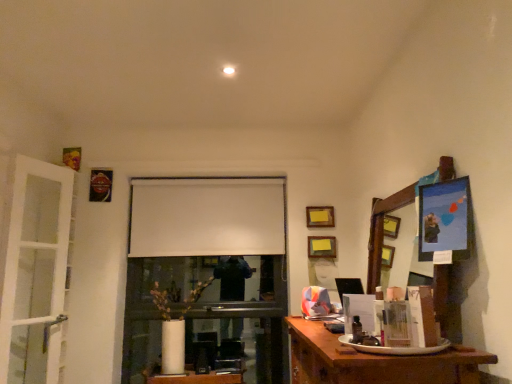
Question: Can you confirm if wooden desk at lower right is smaller than white glass door at left?

Choices:
 (A) no
 (B) yes

Answer: (A)

Question: Could you tell me if wooden desk at lower right is facing white glass door at left?

Choices:
 (A) yes
 (B) no

Answer: (B)

Question: From a real-world perspective, is wooden desk at lower right on white glass door at left?

Choices:
 (A) yes
 (B) no

Answer: (B)

Question: Is the position of wooden desk at lower right more distant than that of white glass door at left?

Choices:
 (A) no
 (B) yes

Answer: (A)

Question: Is wooden desk at lower right to the left of white glass door at left from the viewer's perspective?

Choices:
 (A) yes
 (B) no

Answer: (B)

Question: From a real-world perspective, is wooden desk at lower right physically located above or below yellow matte picture frame at upper center, positioned as the 1th picture frame in bottom-to-top order?

Choices:
 (A) above
 (B) below

Answer: (B)

Question: Would you say wooden desk at lower right is inside or outside yellow matte picture frame at upper center, positioned as the 1th picture frame in bottom-to-top order?

Choices:
 (A) inside
 (B) outside

Answer: (B)

Question: Considering their positions, is wooden desk at lower right located in front of or behind yellow matte picture frame at upper center, which appears as the second picture frame when viewed from the top?

Choices:
 (A) behind
 (B) front

Answer: (B)

Question: Is wooden desk at lower right taller or shorter than yellow matte picture frame at upper center, which appears as the second picture frame when viewed from the top?

Choices:
 (A) tall
 (B) short

Answer: (A)

Question: Is point (240, 182) closer or farther from the camera than point (325, 221)?

Choices:
 (A) closer
 (B) farther

Answer: (B)

Question: Based on their positions, is white matte projection screen at center located to the left or right of wooden picture frame at upper center, marked as the first picture frame in a top-to-bottom arrangement?

Choices:
 (A) right
 (B) left

Answer: (B)

Question: Which is correct: white matte projection screen at center is inside wooden picture frame at upper center, marked as the first picture frame in a top-to-bottom arrangement, or outside of it?

Choices:
 (A) outside
 (B) inside

Answer: (A)

Question: From a real-world perspective, is white matte projection screen at center positioned above or below wooden picture frame at upper center, marked as the first picture frame in a top-to-bottom arrangement?

Choices:
 (A) below
 (B) above

Answer: (B)

Question: From the image's perspective, is wooden desk at lower right positioned above or below white glass door at left?

Choices:
 (A) below
 (B) above

Answer: (A)

Question: Considering the positions of wooden desk at lower right and white glass door at left in the image, is wooden desk at lower right wider or thinner than white glass door at left?

Choices:
 (A) thin
 (B) wide

Answer: (B)